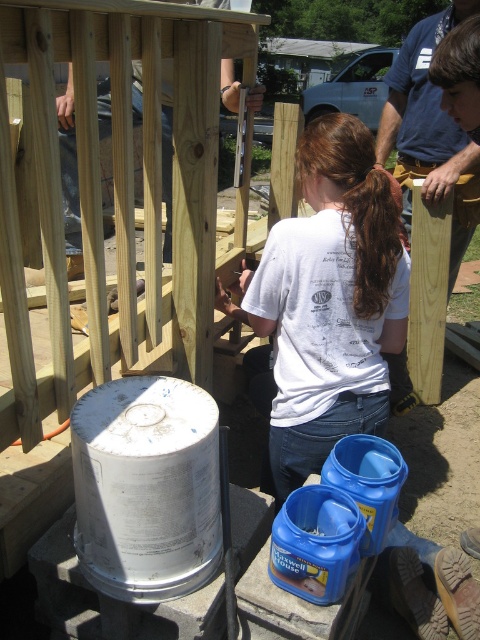
You are a construction worker observing the scene. You notice two shirts in the image. Which shirt, the white cotton shirt at center or the blue shirt at upper center, is taller?

The white cotton shirt at center has a greater height compared to the blue shirt at upper center, so the white cotton shirt at center is taller.

What is the exact coordinate of the white cotton shirt at center?

The white cotton shirt at center is located at coordinate point (x=297, y=348).